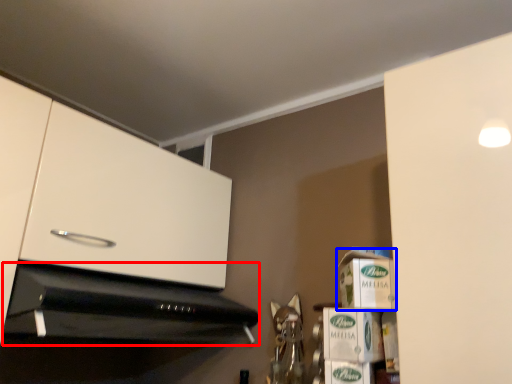
Question: Among these objects, which one is farthest to the camera, home appliance (highlighted by a red box) or cardboard box (highlighted by a blue box)?

Choices:
 (A) home appliance
 (B) cardboard box

Answer: (B)